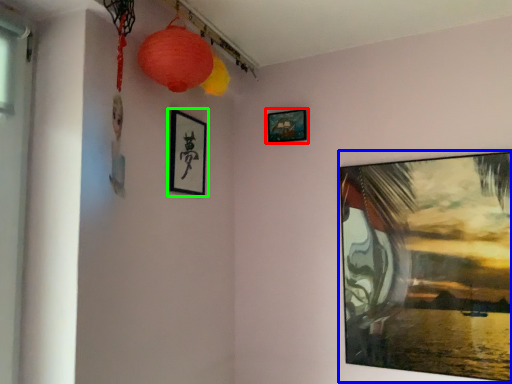
Question: Which is farther away from picture frame (highlighted by a red box)? picture frame (highlighted by a blue box) or picture frame (highlighted by a green box)?

Choices:
 (A) picture frame
 (B) picture frame

Answer: (A)